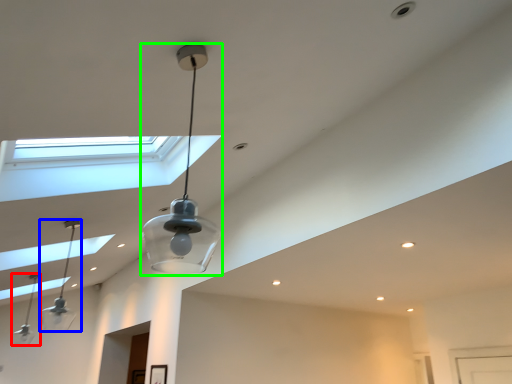
Question: Which object is positioned farthest from lamp (highlighted by a red box)? Select from lamp (highlighted by a blue box) and lamp (highlighted by a green box).

Choices:
 (A) lamp
 (B) lamp

Answer: (B)